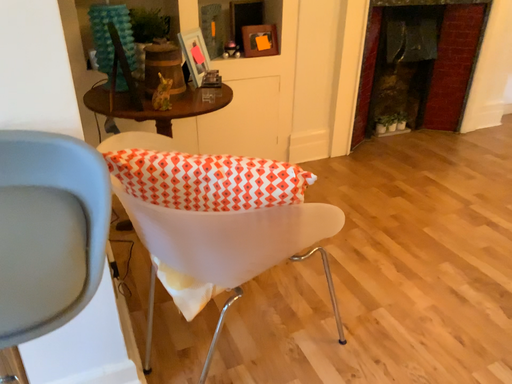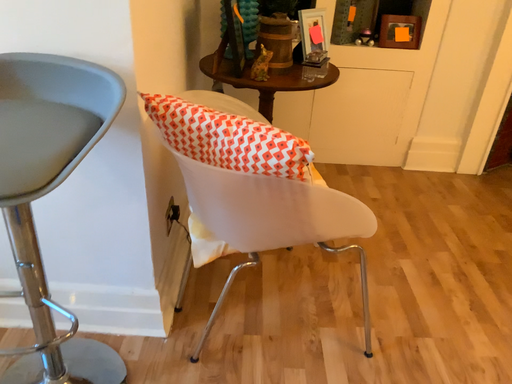
Question: How did the camera likely rotate when shooting the video?

Choices:
 (A) rotated left
 (B) rotated right

Answer: (A)